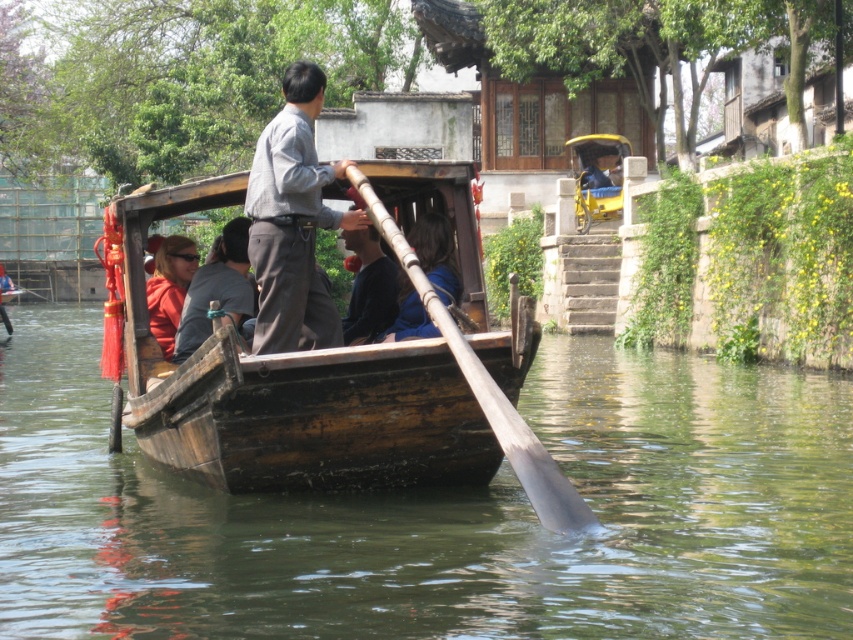
Question: Which point is closer to the camera?

Choices:
 (A) orange fabric jacket at center
 (B) dark blue fabric at center
 (C) gray cotton shirt at center

Answer: (C)

Question: From the image, what is the correct spatial relationship of matte black shirt at center in relation to blue fabric at center?

Choices:
 (A) left
 (B) right

Answer: (A)

Question: Which of the following is the farthest from the observer?

Choices:
 (A) (496, 560)
 (B) (170, 257)
 (C) (253, 330)

Answer: (B)

Question: Is matte black shirt at center further to camera compared to dark blue fabric at center?

Choices:
 (A) yes
 (B) no

Answer: (B)

Question: Is gray cotton shirt at center behind blue fabric at center?

Choices:
 (A) yes
 (B) no

Answer: (B)

Question: Which of these objects is positioned closest to the wooden boat at center?

Choices:
 (A) blue fabric at center
 (B) brown wooden boat at center
 (C) silver polished wood paddle at center

Answer: (C)